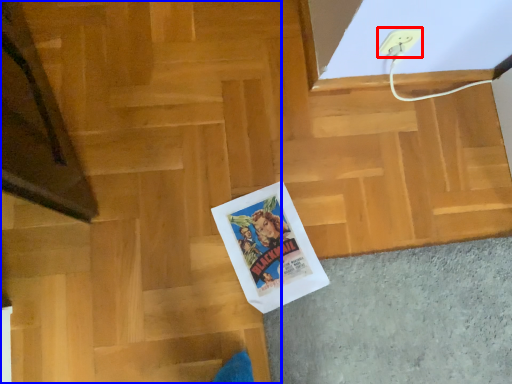
Question: Which of the following is the farthest to the observer, electric outlet (highlighted by a red box) or stairwell (highlighted by a blue box)?

Choices:
 (A) electric outlet
 (B) stairwell

Answer: (A)